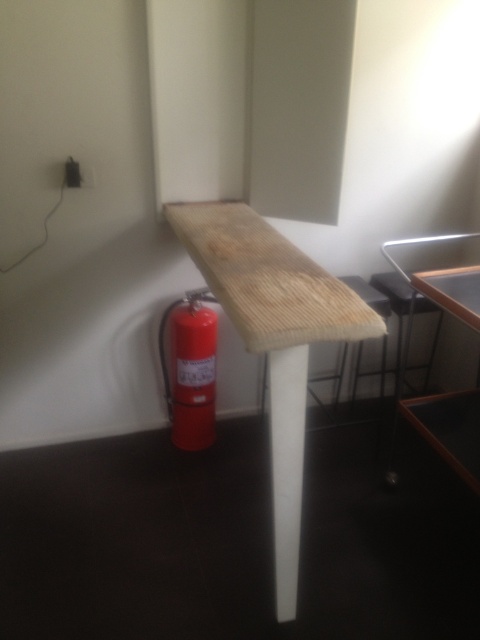
Does natural wood table at center come behind red metallic fire extinguisher at lower left?

Answer: No, natural wood table at center is closer to the viewer.

Does point (301, 328) lie behind point (181, 372)?

No, it is in front of (181, 372).

Find the location of a particular element. The image size is (480, 640). natural wood table at center is located at coordinates (274, 339).